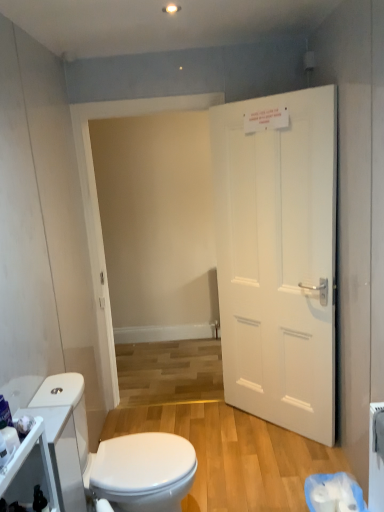
At what (x,y) coordinates should I click in order to perform the action: click on vacant region to the left of white matte door at right. Please return your answer as a coordinate pair (x, y). This screenshot has width=384, height=512. Looking at the image, I should click on (217, 433).